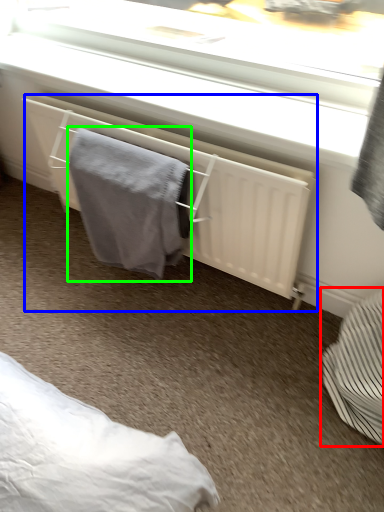
Question: Which object is positioned farthest from furniture (highlighted by a red box)? Select from radiator (highlighted by a blue box) and bath towel (highlighted by a green box).

Choices:
 (A) radiator
 (B) bath towel

Answer: (B)